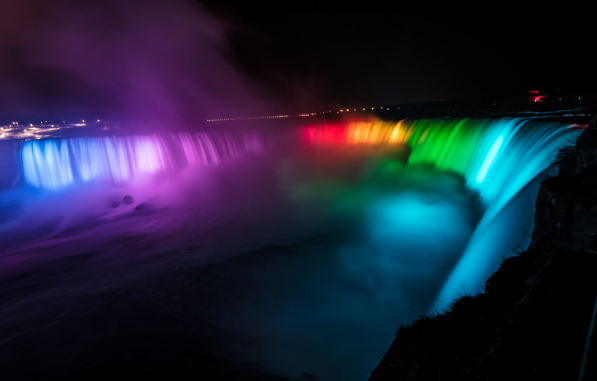
Locate an element on the screen. Image resolution: width=597 pixels, height=381 pixels. sky blue lights is located at coordinates (489, 176), (520, 194).